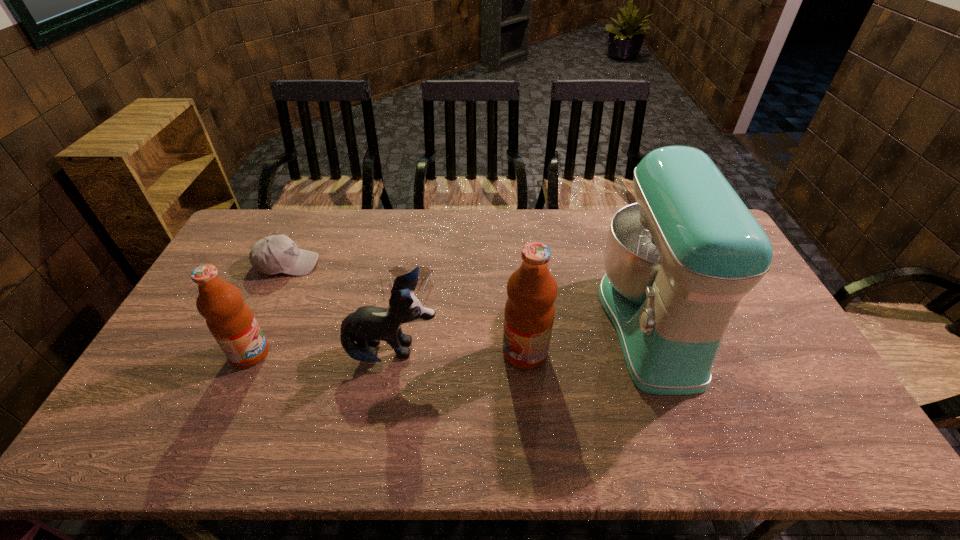
At what (x,y) coordinates should I click in order to perform the action: click on object that is at the left edge. Please return your answer as a coordinate pair (x, y). The image size is (960, 540). Looking at the image, I should click on (274, 254).

Where is `object at the far left corner`? Image resolution: width=960 pixels, height=540 pixels. object at the far left corner is located at coordinates (274, 254).

The height and width of the screenshot is (540, 960). I want to click on vacant space at the far edge, so click(541, 210).

Find the location of a particular element. This screenshot has width=960, height=540. vacant area at the near edge is located at coordinates (469, 386).

Identify the location of vacant space at the left edge of the desktop. (256, 277).

At what (x,y) coordinates should I click in order to perform the action: click on vacant space at the far left corner of the desktop. Please return your answer as a coordinate pair (x, y). This screenshot has width=960, height=540. Looking at the image, I should click on (246, 225).

I want to click on free space at the near left corner of the desktop, so click(167, 403).

Locate an element on the screen. The image size is (960, 540). blank region between the spectacles and the shorter fruit juice is located at coordinates [x=330, y=321].

What are the coordinates of `empty space between the shorter fruit juice and the right fruit juice` in the screenshot? It's located at (388, 353).

This screenshot has width=960, height=540. What are the coordinates of `unoccupied position between the puppy and the shorter fruit juice` in the screenshot? It's located at (322, 353).